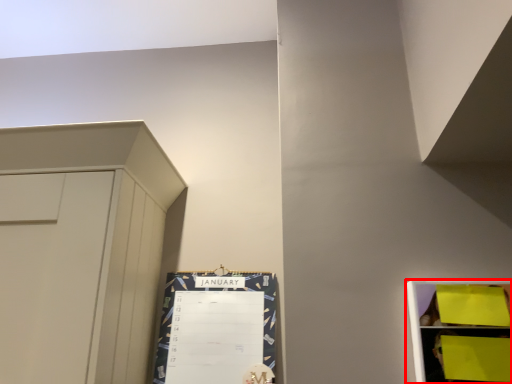
Question: Observing the image, what is the correct spatial positioning of shelf (annotated by the red box) in reference to bulletin board?

Choices:
 (A) left
 (B) right

Answer: (B)